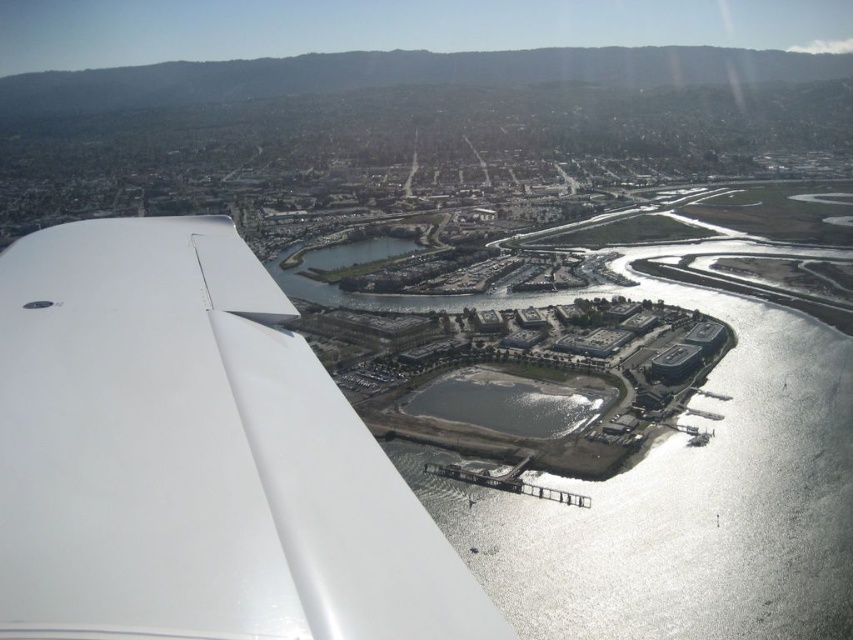
You are a pilot observing the landscape from the airplane window. You notice the white glossy wing at left and the gray concrete waterway at center. Which object appears bigger in the view?

The white glossy wing at left appears bigger in the view because it has a larger size compared to the gray concrete waterway at center.

You are a pilot flying at an altitude of 1,000 meters and want to drop a package at the point labeled point (247, 244). Considering the distance from the camera, will you need to adjust your altitude to ensure the package lands accurately?

The point (247, 244) is 639.18 meters from the camera. Since you are flying at 1,000 meters altitude, you do not need to adjust your altitude because the package will naturally descend to the target point without needing altitude changes.

In the scene shown: You are a pilot looking at the landscape through the airplane window. You notice two points marked on the window at coordinates point (321, 502) and point (540, 381). Which point is closer to you?

Point (321, 502) is closer to the viewer than point (540, 381).